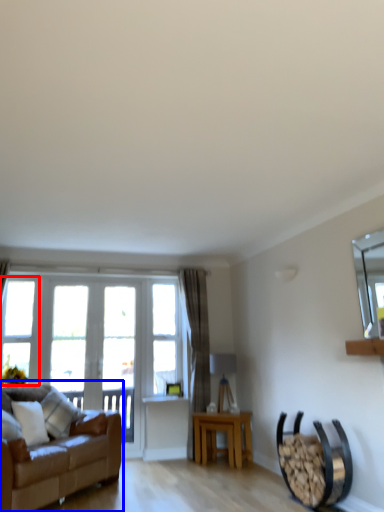
Question: Which object appears closest to the camera in this image, window (highlighted by a red box) or studio couch (highlighted by a blue box)?

Choices:
 (A) window
 (B) studio couch

Answer: (B)